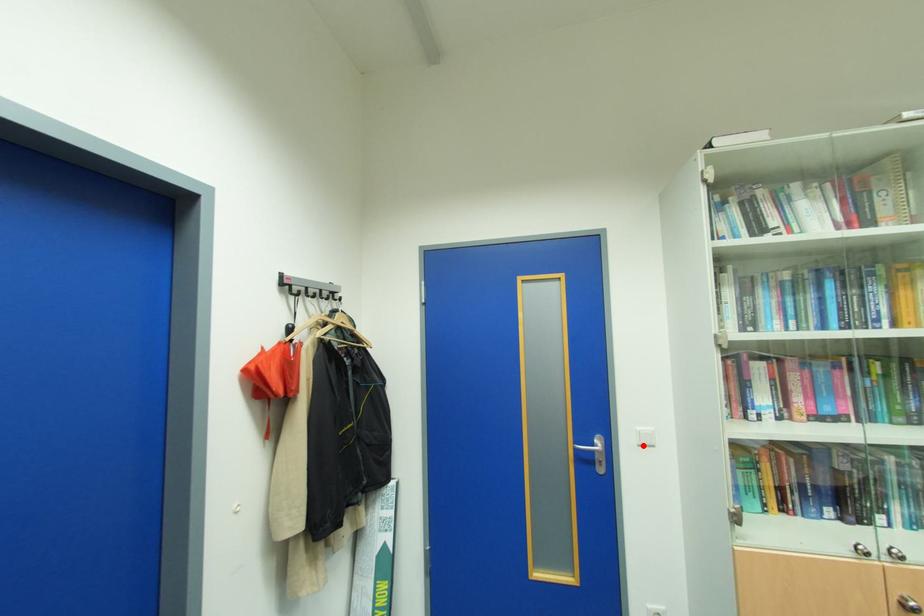
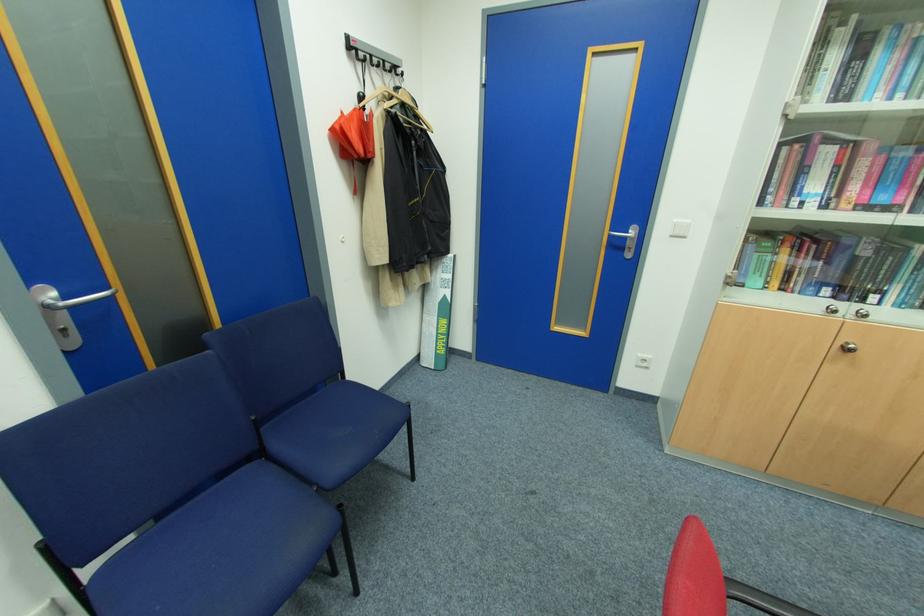
Where in the second image is the point corresponding to the highlighted location from the first image?

(675, 236)